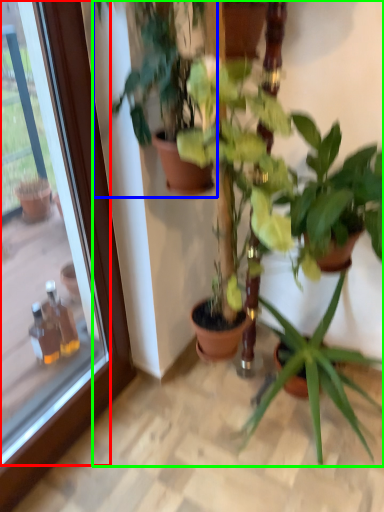
Question: Which object is the closest to the glass door (highlighted by a red box)? Choose among these: houseplant (highlighted by a blue box) or houseplant (highlighted by a green box).

Choices:
 (A) houseplant
 (B) houseplant

Answer: (A)